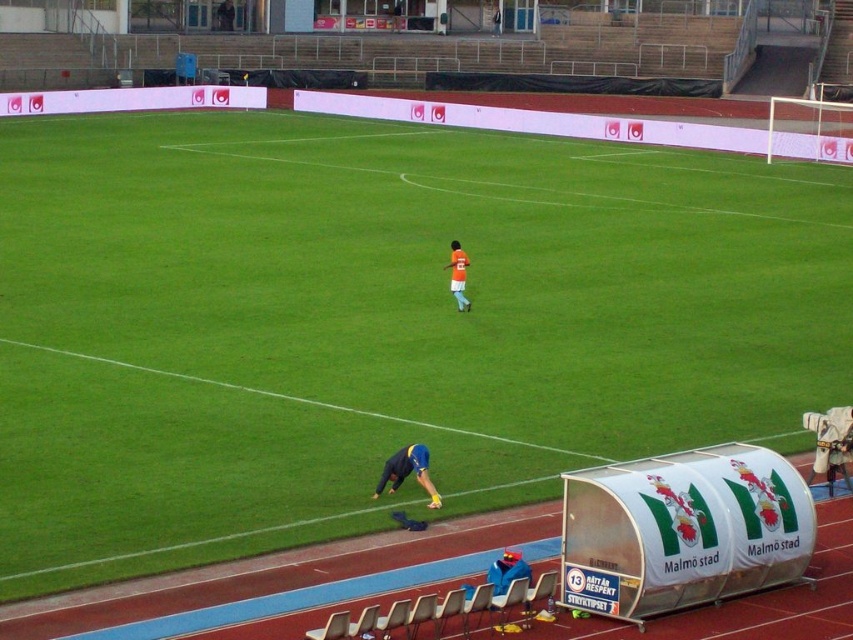
Question: Based on their relative distances, which object is farther from the blue fabric jacket at lower center?

Choices:
 (A) blue fabric at lower center
 (B) orange jersey at center

Answer: (B)

Question: Is blue fabric jacket at lower center bigger than orange jersey at center?

Choices:
 (A) no
 (B) yes

Answer: (A)

Question: Does blue fabric jacket at lower center appear on the right side of orange jersey at center?

Choices:
 (A) no
 (B) yes

Answer: (B)

Question: Which point appears farthest from the camera in this image?

Choices:
 (A) (521, 577)
 (B) (463, 285)
 (C) (410, 467)

Answer: (B)

Question: Is blue fabric at lower center positioned before orange jersey at center?

Choices:
 (A) yes
 (B) no

Answer: (A)

Question: Estimate the real-world distances between objects in this image. Which object is farther from the blue fabric at lower center?

Choices:
 (A) blue fabric jacket at lower center
 (B) orange jersey at center

Answer: (B)